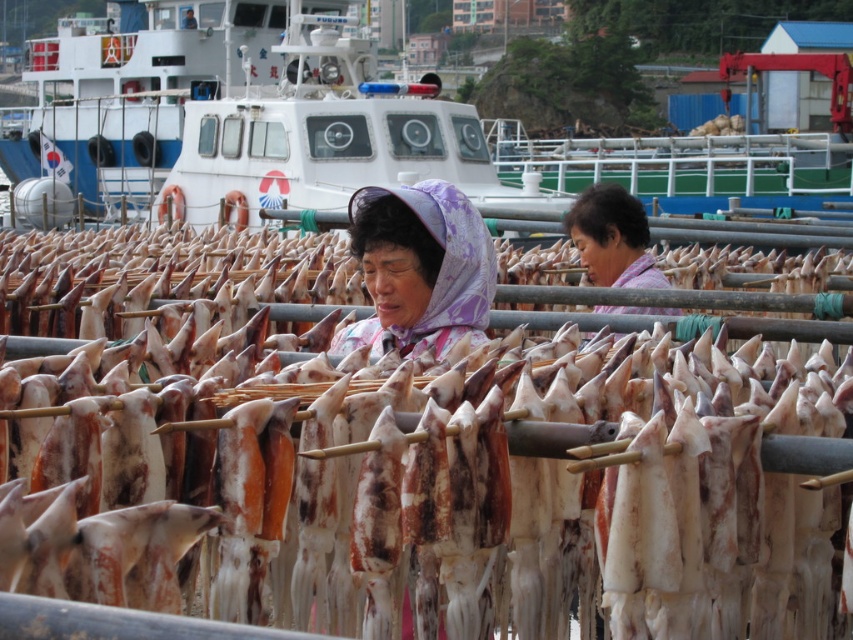
Which is below, white glossy boat at upper center or purple floral headscarf at center?

purple floral headscarf at center

Is white glossy boat at upper center thinner than purple floral headscarf at center?

In fact, white glossy boat at upper center might be wider than purple floral headscarf at center.

The height and width of the screenshot is (640, 853). What are the coordinates of `white glossy boat at upper center` in the screenshot? It's located at (132, 92).

Can you confirm if purple floral headscarf at center is positioned to the left of light purple fabric headscarf at center?

Yes, purple floral headscarf at center is to the left of light purple fabric headscarf at center.

Which is in front, point (408, 264) or point (624, 244)?

Positioned in front is point (408, 264).

Find the location of a particular element. The height and width of the screenshot is (640, 853). purple floral headscarf at center is located at coordinates (421, 266).

How much distance is there between white plastic boat at upper center and white glossy boat at upper center?

white plastic boat at upper center is 43.83 feet away from white glossy boat at upper center.

Does white plastic boat at upper center appear over white glossy boat at upper center?

Actually, white plastic boat at upper center is below white glossy boat at upper center.

What do you see at coordinates (328, 138) in the screenshot? This screenshot has height=640, width=853. I see `white plastic boat at upper center` at bounding box center [328, 138].

Where is `white plastic boat at upper center`? white plastic boat at upper center is located at coordinates (328, 138).